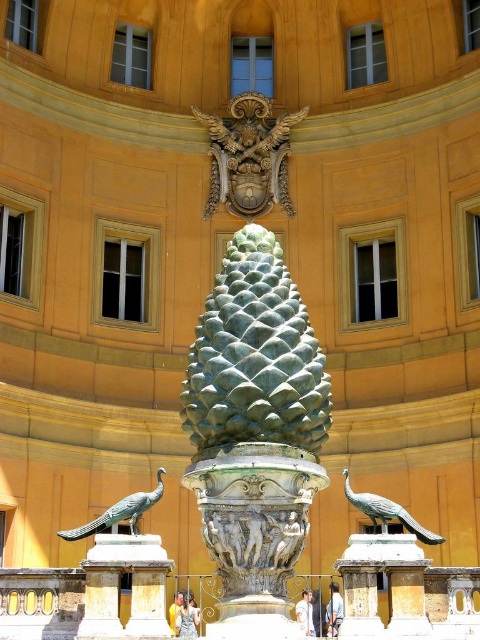
Question: Which point is farther to the camera?

Choices:
 (A) gold/gilded wood carving at upper center
 (B) polished bronze peacock at lower left
 (C) green patina stone pine cone at center
 (D) polished bronze peacock at lower right

Answer: (A)

Question: Can you confirm if green patina stone pine cone at center is positioned below polished bronze peacock at lower left?

Choices:
 (A) yes
 (B) no

Answer: (B)

Question: Can you confirm if polished bronze peacock at lower left is thinner than polished bronze peacock at lower right?

Choices:
 (A) no
 (B) yes

Answer: (A)

Question: Which is nearer to the polished bronze peacock at lower left?

Choices:
 (A) polished bronze peacock at lower right
 (B) gold/gilded wood carving at upper center
 (C) green patina stone pine cone at center

Answer: (C)

Question: Which object is positioned closest to the polished bronze peacock at lower left?

Choices:
 (A) gold/gilded wood carving at upper center
 (B) green patina stone pine cone at center

Answer: (B)

Question: Is green patina stone pine cone at center to the left of gold/gilded wood carving at upper center from the viewer's perspective?

Choices:
 (A) yes
 (B) no

Answer: (B)